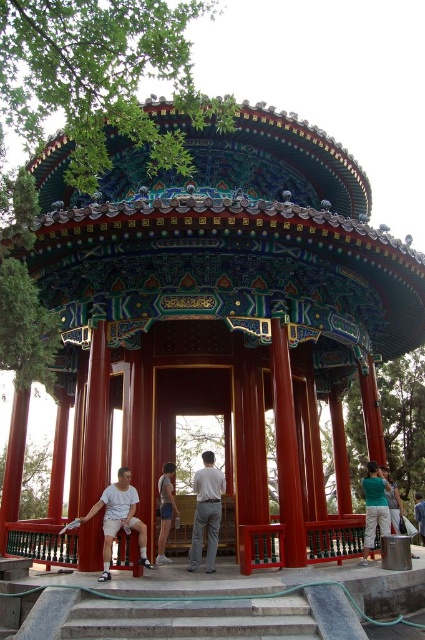
From the picture: Which of these two, light brown fabric pants at center or denim shorts at center, stands shorter?

Standing shorter between the two is denim shorts at center.

The width and height of the screenshot is (425, 640). Describe the element at coordinates (206, 513) in the screenshot. I see `light brown fabric pants at center` at that location.

Between point (200, 509) and point (167, 532), which one is positioned behind?

Point (167, 532)

You are a GUI agent. You are given a task and a screenshot of the screen. Output one action in this format:
    pyautogui.click(x=<x>, y=<y>)
    Task: Click on the light brown fabric pants at center
    The height and width of the screenshot is (640, 425).
    Given the screenshot: What is the action you would take?
    pyautogui.click(x=206, y=513)

Which is below, concrete stairs at center or light brown fabric pants at center?

Positioned lower is concrete stairs at center.

What do you see at coordinates (190, 620) in the screenshot?
I see `concrete stairs at center` at bounding box center [190, 620].

Identify the location of concrete stairs at center. (190, 620).

Does concrete stairs at center have a lesser width compared to denim shorts at center?

No.

You are a GUI agent. You are given a task and a screenshot of the screen. Output one action in this format:
    pyautogui.click(x=<x>, y=<y>)
    Task: Click on the concrete stairs at center
    The height and width of the screenshot is (640, 425).
    Given the screenshot: What is the action you would take?
    pyautogui.click(x=190, y=620)